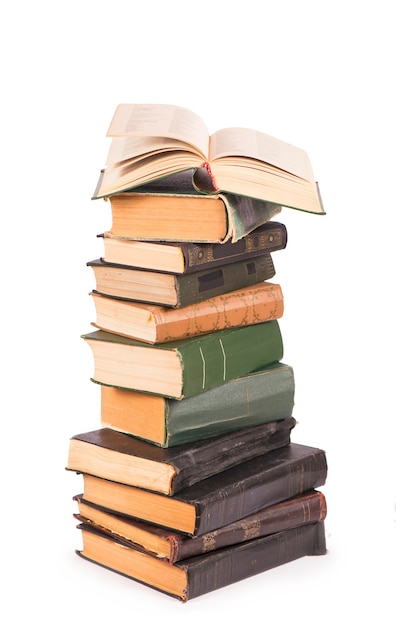
The image size is (396, 626). I want to click on book stack, so click(218, 568), click(249, 529), click(220, 499), click(210, 422), click(201, 367), click(194, 326), click(202, 456), click(227, 274), click(239, 217), click(193, 178).